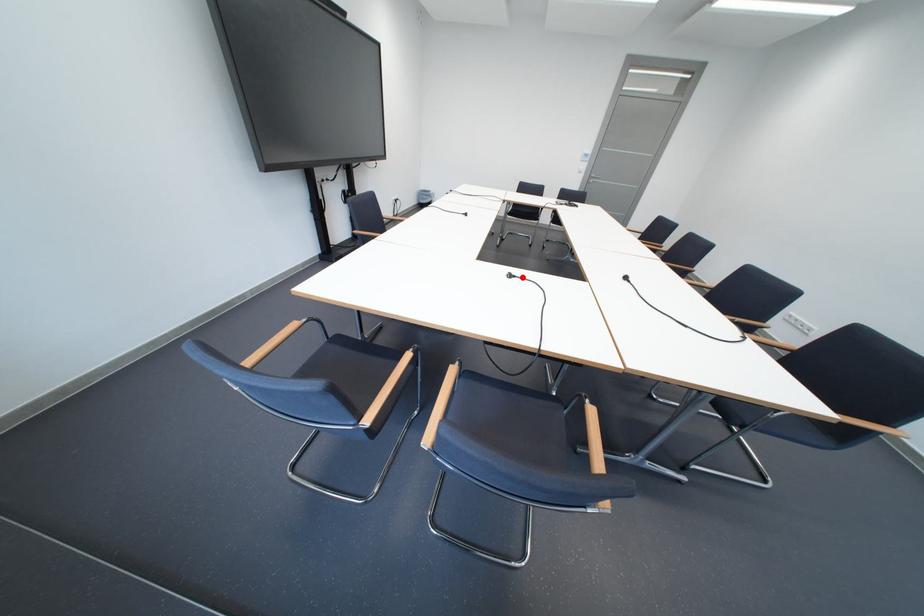
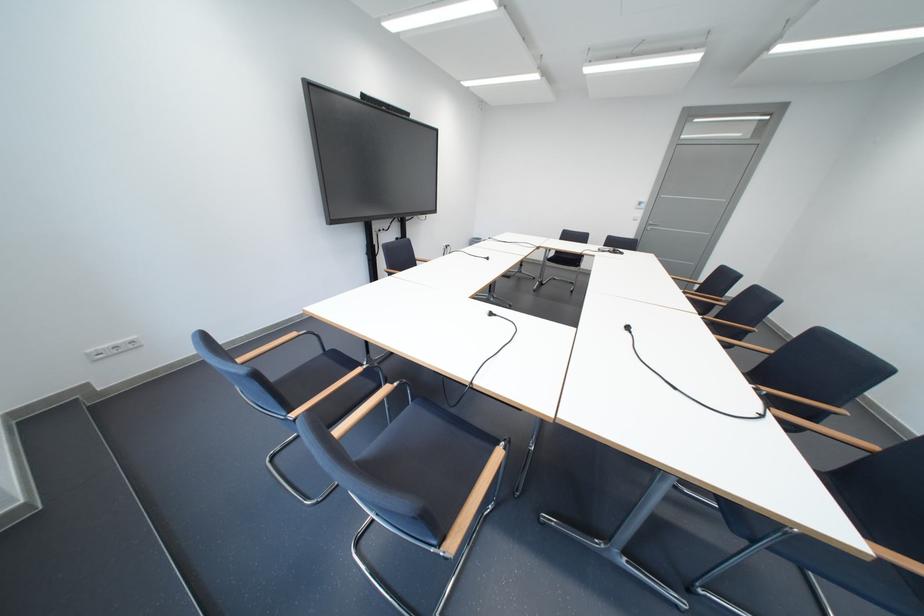
Find the pixel in the second image that matches the highlighted location in the first image.

(503, 315)